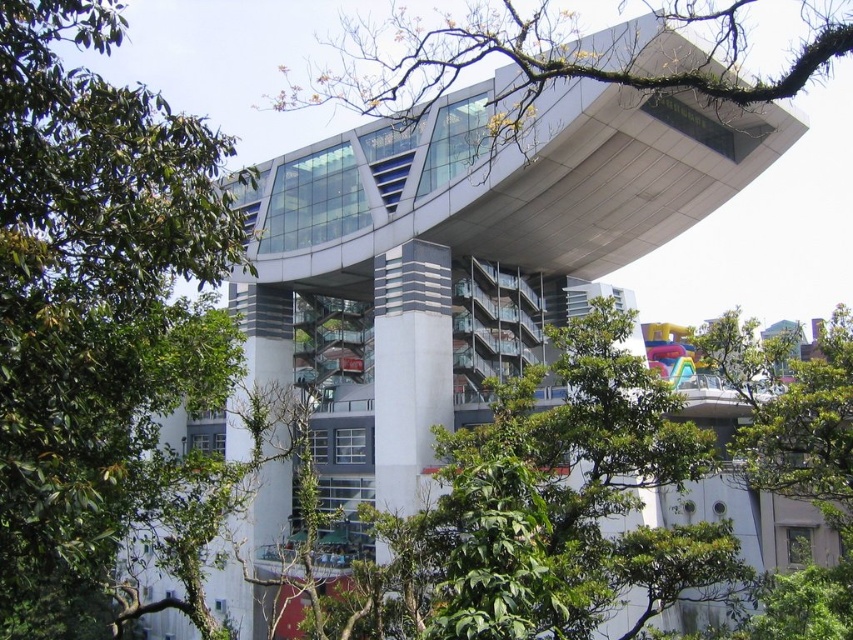
You are standing at the point where the camera is located, looking at the modern building. If you walk straight towards the point at coordinates point (86, 352), how far will you have to walk to reach it?

The point point (86, 352) is 25.47 meters away from the camera, so you will have to walk 25.47 meters to reach it.

You are a drone operator trying to fly a drone between the green leafy tree at upper left and the green leafy branch at upper center. The drone has a maximum flight distance of 40 meters. Can the drone safely navigate this path without exceeding its range?

The distance between the green leafy tree at upper left and the green leafy branch at upper center is 41.69 meters. Since the drone can only fly up to 40 meters, it cannot safely navigate this path without exceeding its range.

You are an architect analyzing the building design. You notice the green leafy tree at upper left and the green leafy branch at upper center in the image. Which of these two elements is taller?

The green leafy tree at upper left is taller than the green leafy branch at upper center according to the description.